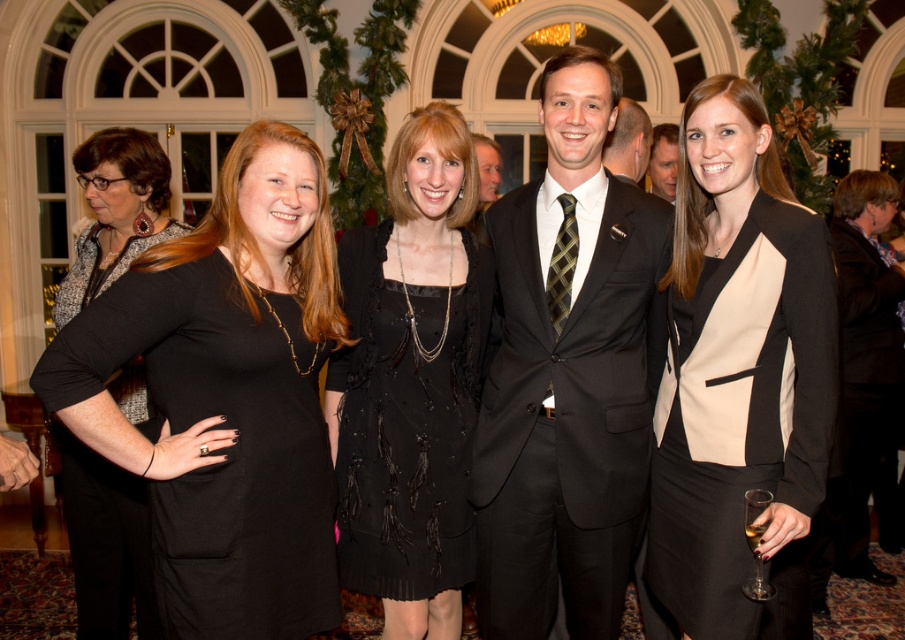
Where is `black dress at center`? black dress at center is located at coordinates (226, 396).

Between black dress at center and black matte suit at center, which one is positioned higher?

black matte suit at center is above.

The image size is (905, 640). I want to click on black dress at center, so click(226, 396).

At what (x,y) coordinates should I click in order to perform the action: click on black dress at center. Please return your answer as a coordinate pair (x, y). Image resolution: width=905 pixels, height=640 pixels. Looking at the image, I should click on point(226,396).

Is black satin dress at center below matte black dress at left?

Incorrect, black satin dress at center is not positioned below matte black dress at left.

In the scene shown: Who is more distant from viewer, (453, 433) or (153, 620)?

The point (153, 620) is more distant.

I want to click on black satin dress at center, so click(411, 381).

Can you confirm if black matte blazer at center is wider than black leather jacket at center?

Incorrect, black matte blazer at center's width does not surpass black leather jacket at center's.

Looking at this image, who is more distant from viewer, (761, 216) or (849, 321)?

Positioned behind is point (849, 321).

Where is `black matte blazer at center`? The image size is (905, 640). black matte blazer at center is located at coordinates (737, 364).